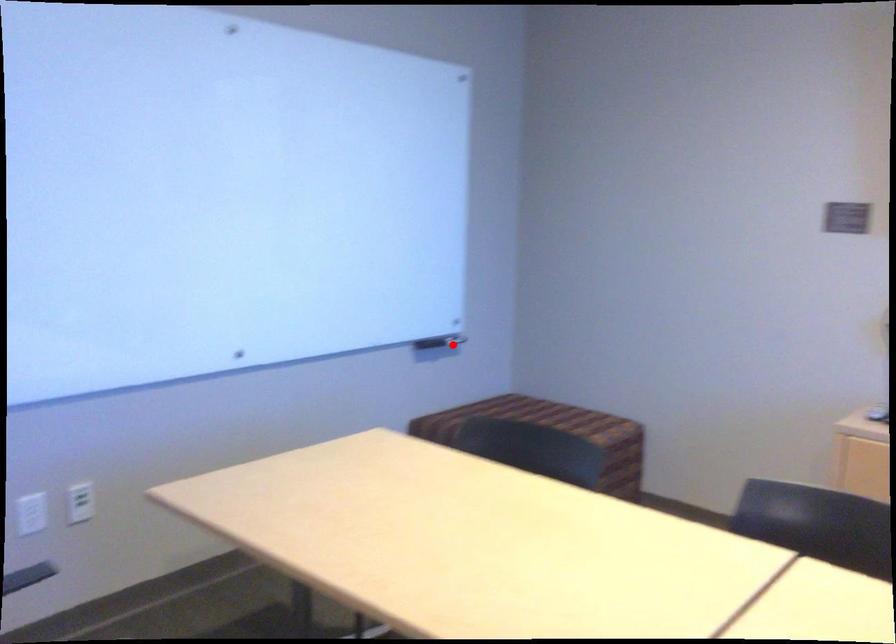
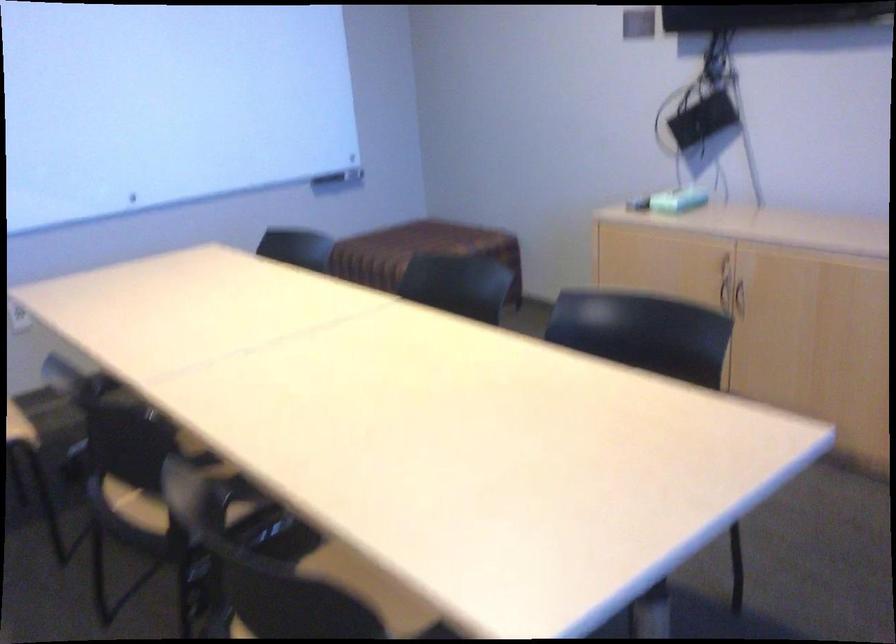
Question: I am providing you with two images of the same scene from different viewpoints. A red point is marked on the first image. At the location where the point appears in image 1, is it still visible in image 2?

Choices:
 (A) Yes
 (B) No

Answer: (A)